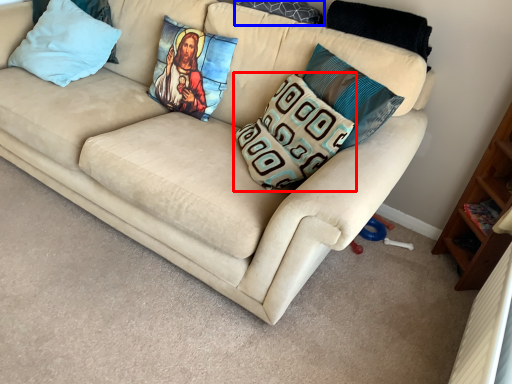
Question: Which object is closer to the camera taking this photo, pillow (highlighted by a red box) or pillow (highlighted by a blue box)?

Choices:
 (A) pillow
 (B) pillow

Answer: (A)